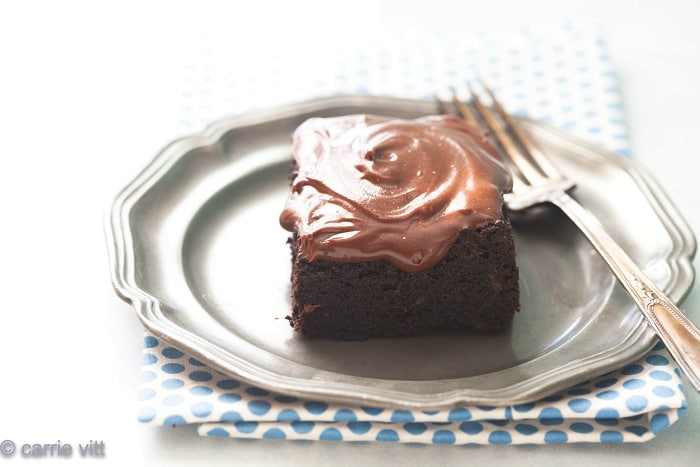
You are a GUI agent. You are given a task and a screenshot of the screen. Output one action in this format:
    pyautogui.click(x=<x>, y=<y>)
    Task: Click on the fork
    The height and width of the screenshot is (467, 700).
    Given the screenshot: What is the action you would take?
    pyautogui.click(x=537, y=179)